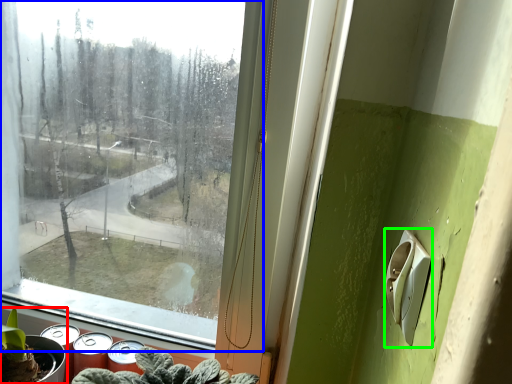
Question: Which object is the closest to the houseplant (highlighted by a red box)? Choose among these: window (highlighted by a blue box) or light switch (highlighted by a green box).

Choices:
 (A) window
 (B) light switch

Answer: (B)